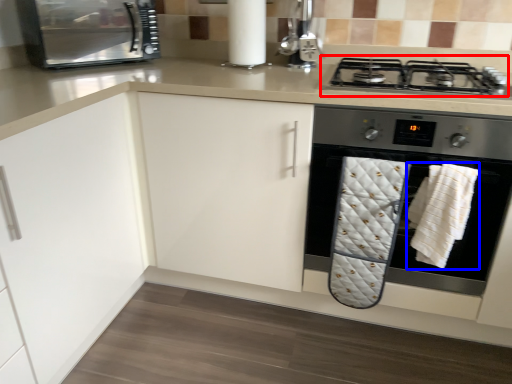
Question: Among these objects, which one is farthest to the camera, gas stove (highlighted by a red box) or bath towel (highlighted by a blue box)?

Choices:
 (A) gas stove
 (B) bath towel

Answer: (A)